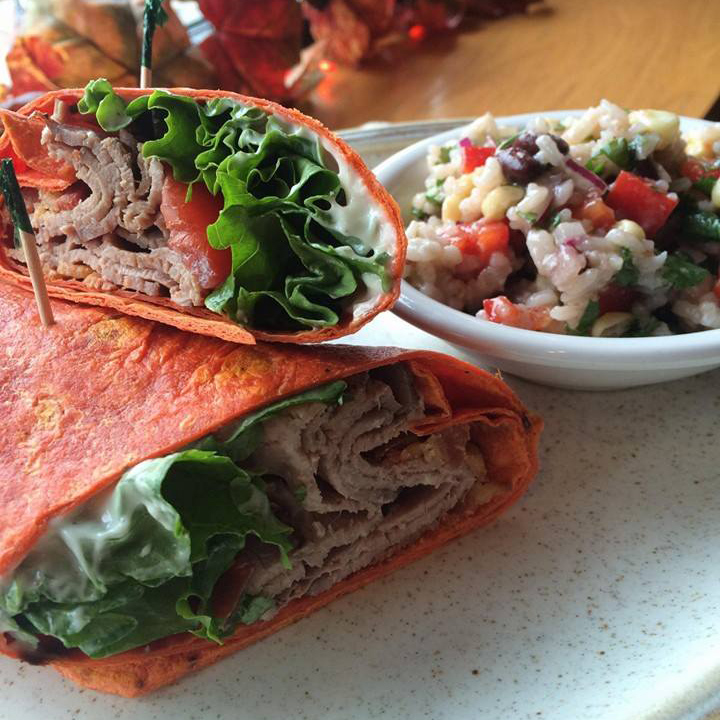
The image size is (720, 720). I want to click on wooden surface, so click(x=505, y=60).